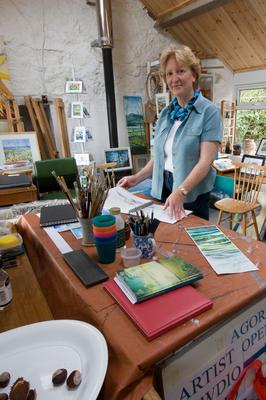
Where is `window`? The height and width of the screenshot is (400, 266). window is located at coordinates (250, 115).